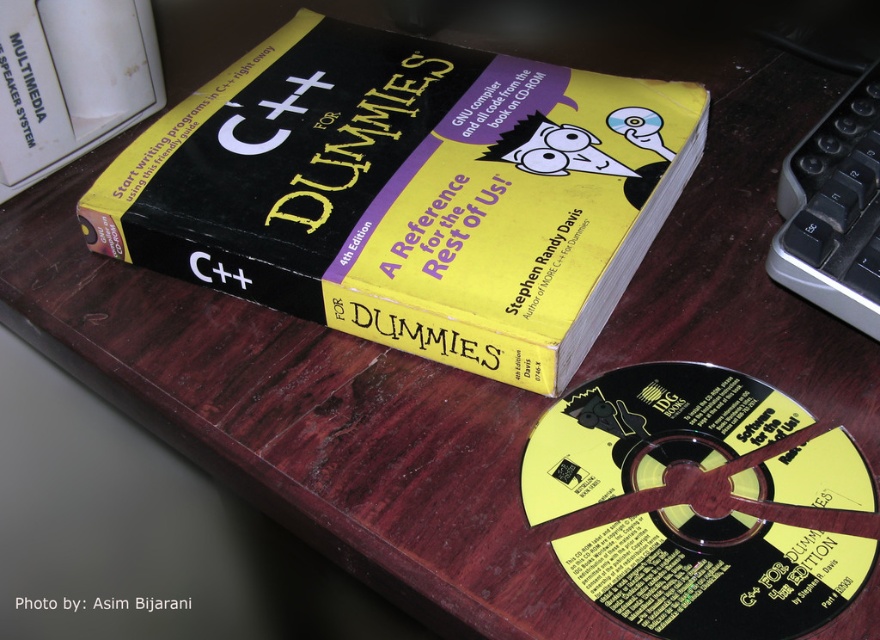
Question: Among these objects, which one is nearest to the camera?

Choices:
 (A) black plastic cd at lower right
 (B) black matte book at center

Answer: (A)

Question: Can you confirm if black matte book at center is smaller than black plastic cd at lower right?

Choices:
 (A) no
 (B) yes

Answer: (A)

Question: Which point is closer to the camera?

Choices:
 (A) black plastic cd at lower right
 (B) black matte book at center

Answer: (A)

Question: Is black matte book at center further to the viewer compared to black plastic cd at lower right?

Choices:
 (A) yes
 (B) no

Answer: (A)

Question: Can you confirm if black matte book at center is smaller than black plastic cd at lower right?

Choices:
 (A) yes
 (B) no

Answer: (B)